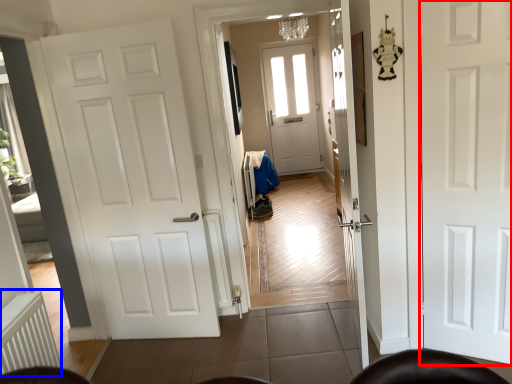
Question: Which point is further to the camera, door (highlighted by a red box) or radiator (highlighted by a blue box)?

Choices:
 (A) door
 (B) radiator

Answer: (A)